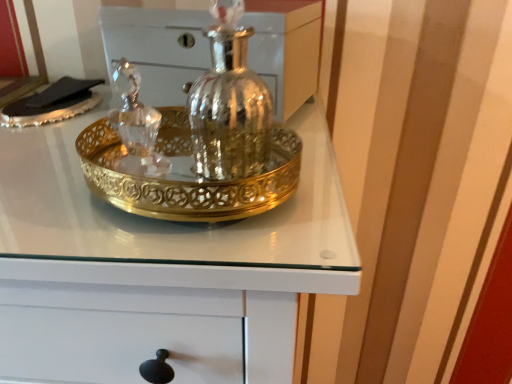
Question: Looking at the image, does gold metallic tray at center seem bigger or smaller compared to polished silver vase at center?

Choices:
 (A) small
 (B) big

Answer: (B)

Question: From a real-world perspective, is gold metallic tray at center above or below polished silver vase at center?

Choices:
 (A) below
 (B) above

Answer: (B)

Question: Looking at their shapes, would you say gold metallic tray at center is wider or thinner than polished silver vase at center?

Choices:
 (A) thin
 (B) wide

Answer: (B)

Question: Looking at their shapes, would you say polished silver vase at center is wider or thinner than gold metallic tray at center?

Choices:
 (A) thin
 (B) wide

Answer: (A)

Question: Is polished silver vase at center to the left or to the right of gold metallic tray at center in the image?

Choices:
 (A) left
 (B) right

Answer: (B)

Question: From their relative heights in the image, would you say polished silver vase at center is taller or shorter than gold metallic tray at center?

Choices:
 (A) short
 (B) tall

Answer: (A)

Question: From the image's perspective, relative to gold metallic tray at center, is polished silver vase at center above or below?

Choices:
 (A) below
 (B) above

Answer: (B)